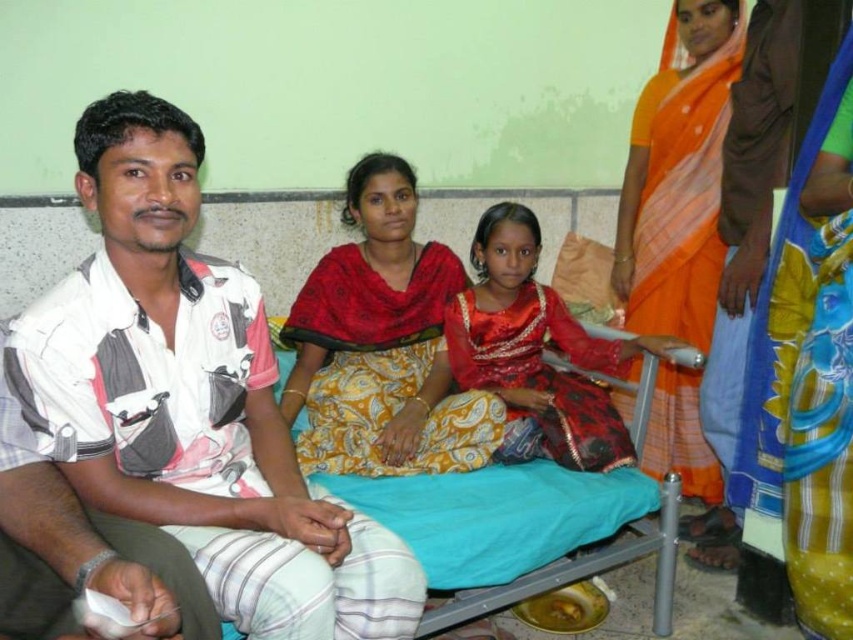
Does white printed shirt at left have a lesser height compared to orange silk saree at upper right?

Yes.

Does white printed shirt at left appear over orange silk saree at upper right?

No.

The width and height of the screenshot is (853, 640). Describe the element at coordinates (190, 400) in the screenshot. I see `white printed shirt at left` at that location.

Where is `white printed shirt at left`? The height and width of the screenshot is (640, 853). white printed shirt at left is located at coordinates (190, 400).

Is point (624, 276) closer to camera compared to point (476, 236)?

No.

Can you confirm if orange silk saree at upper right is positioned above shiny red sari at center?

Yes.

The image size is (853, 640). Find the location of `orange silk saree at upper right`. orange silk saree at upper right is located at coordinates (677, 176).

Is yellow paisley sari at center above shiny red sari at center?

Indeed, yellow paisley sari at center is positioned over shiny red sari at center.

At what (x,y) coordinates should I click in order to perform the action: click on yellow paisley sari at center. Please return your answer as a coordinate pair (x, y). This screenshot has width=853, height=640. Looking at the image, I should click on (381, 344).

Identify the location of yellow paisley sari at center. Image resolution: width=853 pixels, height=640 pixels. (381, 344).